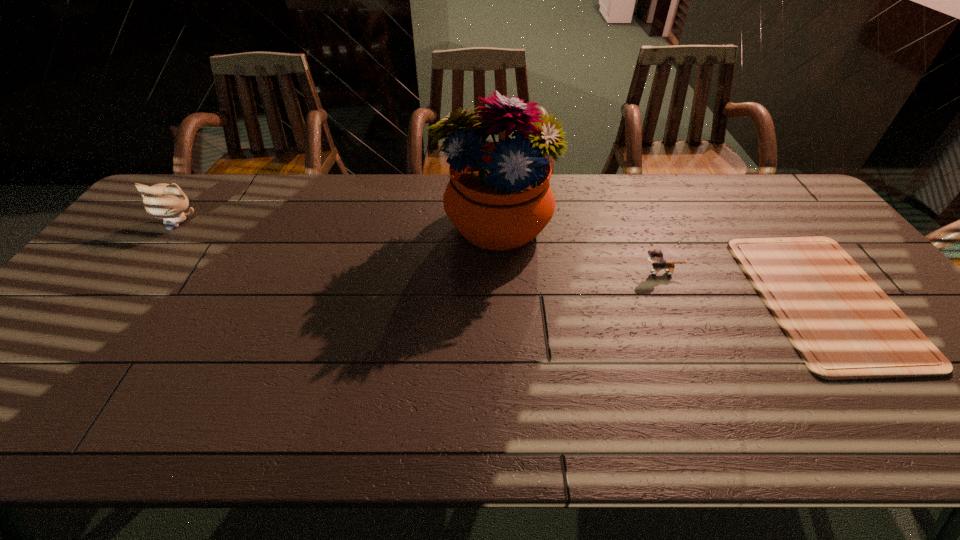
Identify the location of flower arrangement. Image resolution: width=960 pixels, height=540 pixels. (499, 197).

Locate an element on the screen. The height and width of the screenshot is (540, 960). the tallest object is located at coordinates (499, 197).

The image size is (960, 540). In order to click on the taller kitten in this screenshot , I will do `click(166, 201)`.

You are a GUI agent. You are given a task and a screenshot of the screen. Output one action in this format:
    pyautogui.click(x=<x>, y=<y>)
    Task: Click on the farther kitten
    Image resolution: width=960 pixels, height=540 pixels.
    Given the screenshot: What is the action you would take?
    166,201

Identify the location of the nearer kitten. This screenshot has height=540, width=960. (655, 257).

The width and height of the screenshot is (960, 540). I want to click on the third object from left to right, so click(655, 257).

The height and width of the screenshot is (540, 960). I want to click on vacant point located 0.090m on the back of the flower arrangement, so click(492, 181).

You are a GUI agent. You are given a task and a screenshot of the screen. Output one action in this format:
    pyautogui.click(x=<x>, y=<y>)
    Task: Click on the free space located on the face of the leftmost object
    
    Given the screenshot: What is the action you would take?
    pyautogui.click(x=91, y=333)

I want to click on blank space located 0.120m on the front-facing side of the right kitten, so click(598, 272).

The image size is (960, 540). In order to click on vacant space located 0.390m on the front-facing side of the right kitten in this screenshot , I will do `click(500, 272)`.